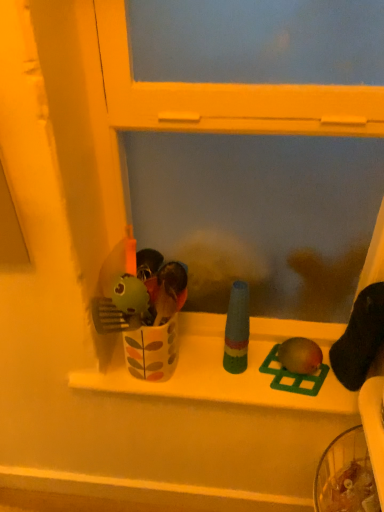
Find the location of a particular element. The image size is (384, 512). empty space that is ontop of white glossy window sill at center (from a real-world perspective) is located at coordinates (228, 369).